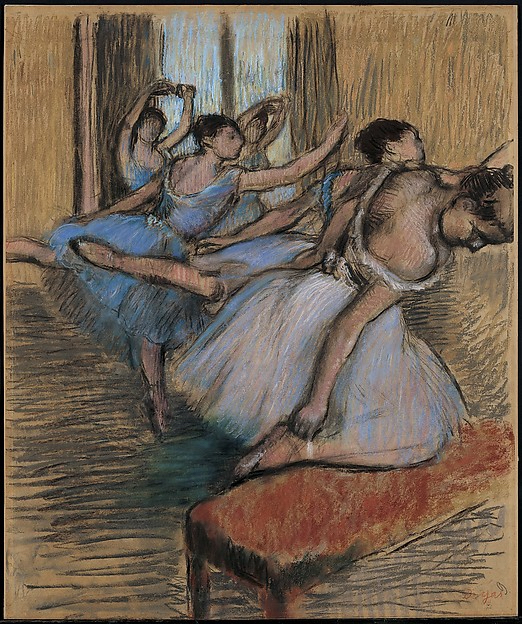
Where is `"the dancers" painting by edgar degas`? The width and height of the screenshot is (522, 624). "the dancers" painting by edgar degas is located at coordinates (34, 80).